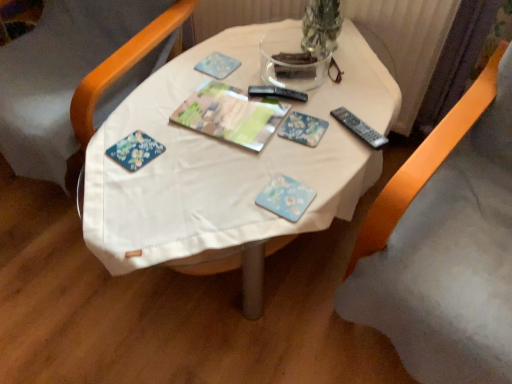
Locate an element on the screen. The image size is (512, 384). vacant space to the right of floral-patterned paper at center-left is located at coordinates (199, 160).